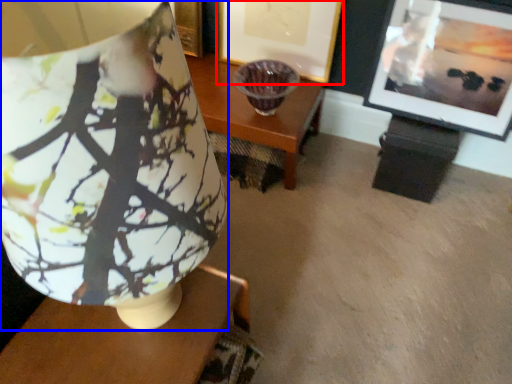
Question: Which of the following is the closest to the observer, picture frame (highlighted by a red box) or lamp (highlighted by a blue box)?

Choices:
 (A) picture frame
 (B) lamp

Answer: (B)